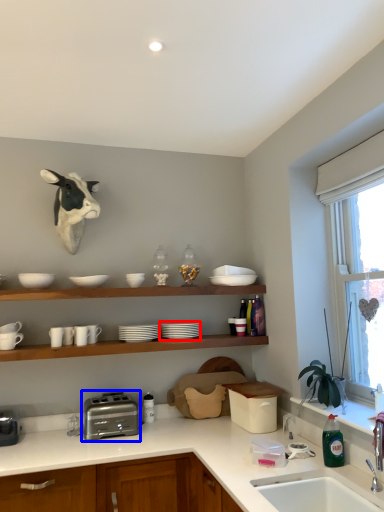
Question: Which point is further to the camera, tableware (highlighted by a red box) or toaster (highlighted by a blue box)?

Choices:
 (A) tableware
 (B) toaster

Answer: (A)